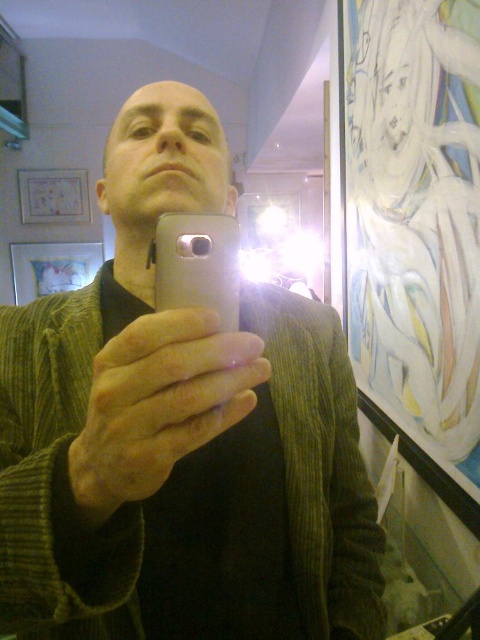
Between point (67, 358) and point (171, 241), which one is positioned behind?

Positioned behind is point (67, 358).

Looking at this image, is matte silver phone at center positioned before silver metallic phone at center?

Yes.

Is point (344, 600) positioned before point (178, 285)?

That is False.

Image resolution: width=480 pixels, height=640 pixels. I want to click on matte silver phone at center, so click(x=180, y=435).